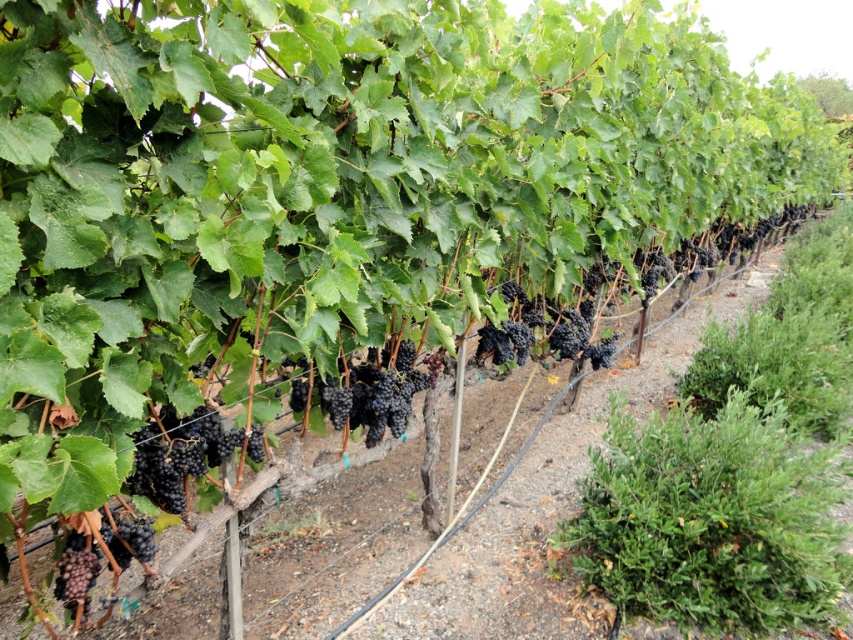
Identify the location of shiny purple grapes at center. The width and height of the screenshot is (853, 640). (184, 452).

Is shiny purple grapes at center bigger than shiny dark purple grapes at center?

No, shiny purple grapes at center is not bigger than shiny dark purple grapes at center.

From the picture: Who is more distant from viewer, (x=166, y=493) or (x=409, y=392)?

The point (x=409, y=392) is more distant.

Where is `shiny purple grapes at center`? shiny purple grapes at center is located at coordinates (184, 452).

Between shiny dark purple grapes at center and black matte grapes at lower left, which one is positioned lower?

black matte grapes at lower left

Which is in front, point (398, 346) or point (61, 576)?

Point (61, 576) is in front.

Image resolution: width=853 pixels, height=640 pixels. I want to click on shiny dark purple grapes at center, so click(x=370, y=392).

The width and height of the screenshot is (853, 640). What do you see at coordinates (184, 452) in the screenshot?
I see `shiny purple grapes at center` at bounding box center [184, 452].

Is shiny purple grapes at center taller than black matte grapes at lower left?

Indeed, shiny purple grapes at center has a greater height compared to black matte grapes at lower left.

Describe the element at coordinates (184, 452) in the screenshot. This screenshot has height=640, width=853. I see `shiny purple grapes at center` at that location.

Image resolution: width=853 pixels, height=640 pixels. I want to click on shiny purple grapes at center, so click(184, 452).